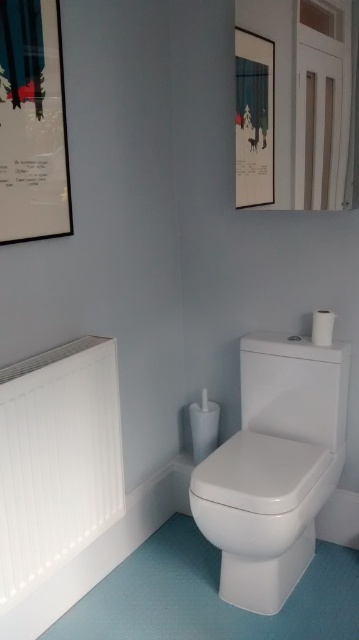
Question: Among these objects, which one is nearest to the camera?

Choices:
 (A) white glossy toilet lid at center
 (B) white glossy toilet at lower right
 (C) white matte radiator at left
 (D) metallic silver picture frame at upper left

Answer: (C)

Question: Is white glossy toilet at lower right in front of white matte radiator at left?

Choices:
 (A) no
 (B) yes

Answer: (A)

Question: Among these objects, which one is farthest from the camera?

Choices:
 (A) metallic silver picture frame at upper left
 (B) matte black picture frame at upper center
 (C) white glossy toilet at lower right

Answer: (B)

Question: Does white glossy toilet lid at center appear under matte black picture frame at upper center?

Choices:
 (A) no
 (B) yes

Answer: (B)

Question: Which of the following is the farthest from the observer?

Choices:
 (A) (11, 429)
 (B) (263, 436)

Answer: (B)

Question: Considering the relative positions of metallic silver picture frame at upper left and matte black picture frame at upper center in the image provided, where is metallic silver picture frame at upper left located with respect to matte black picture frame at upper center?

Choices:
 (A) below
 (B) above

Answer: (A)